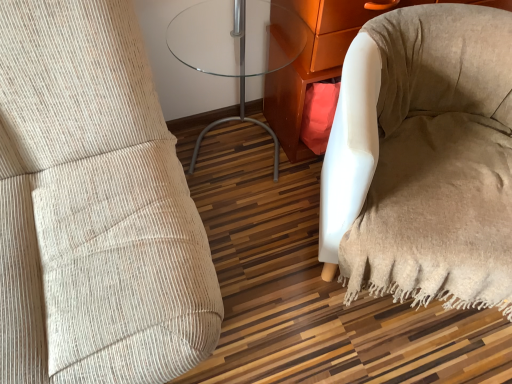
Question: From the image's perspective, would you say white fabric armchair at lower right is positioned over beige fabric bean bag chair at lower right?

Choices:
 (A) no
 (B) yes

Answer: (B)

Question: From the image's perspective, is white fabric armchair at lower right located beneath beige fabric bean bag chair at lower right?

Choices:
 (A) no
 (B) yes

Answer: (A)

Question: Can you confirm if white fabric armchair at lower right is thinner than beige fabric bean bag chair at lower right?

Choices:
 (A) no
 (B) yes

Answer: (B)

Question: Is white fabric armchair at lower right to the right of beige fabric bean bag chair at lower right from the viewer's perspective?

Choices:
 (A) yes
 (B) no

Answer: (B)

Question: Is white fabric armchair at lower right behind beige fabric bean bag chair at lower right?

Choices:
 (A) yes
 (B) no

Answer: (A)

Question: Relative to white fabric armchair at lower right, is transparent glass table at center in front or behind?

Choices:
 (A) behind
 (B) front

Answer: (B)

Question: Considering the positions of transparent glass table at center and white fabric armchair at lower right in the image, is transparent glass table at center taller or shorter than white fabric armchair at lower right?

Choices:
 (A) tall
 (B) short

Answer: (A)

Question: Is transparent glass table at center wider or thinner than white fabric armchair at lower right?

Choices:
 (A) thin
 (B) wide

Answer: (B)

Question: From a real-world perspective, is transparent glass table at center above or below white fabric armchair at lower right?

Choices:
 (A) below
 (B) above

Answer: (B)

Question: Is point click(x=271, y=117) closer or farther from the camera than point click(x=182, y=54)?

Choices:
 (A) farther
 (B) closer

Answer: (A)

Question: From a real-world perspective, is white fabric armchair at lower right physically located above or below transparent glass table at center?

Choices:
 (A) above
 (B) below

Answer: (B)

Question: Based on their sizes in the image, would you say white fabric armchair at lower right is bigger or smaller than transparent glass table at center?

Choices:
 (A) big
 (B) small

Answer: (A)

Question: Based on their positions, is white fabric armchair at lower right located to the left or right of transparent glass table at center?

Choices:
 (A) right
 (B) left

Answer: (A)

Question: Is white fabric armchair at lower right in front of or behind beige fabric bean bag chair at lower right in the image?

Choices:
 (A) front
 (B) behind

Answer: (B)

Question: Based on their sizes in the image, would you say white fabric armchair at lower right is bigger or smaller than beige fabric bean bag chair at lower right?

Choices:
 (A) big
 (B) small

Answer: (B)